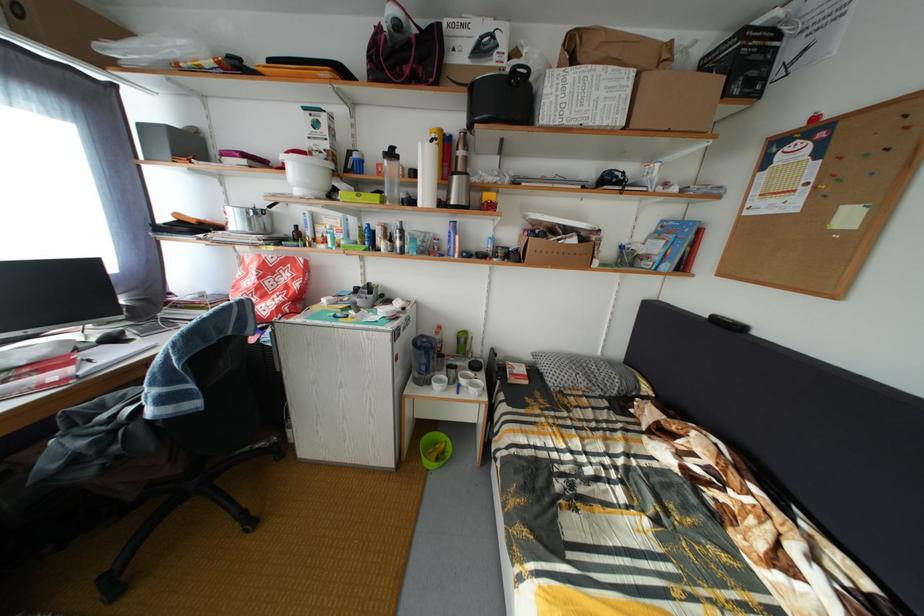
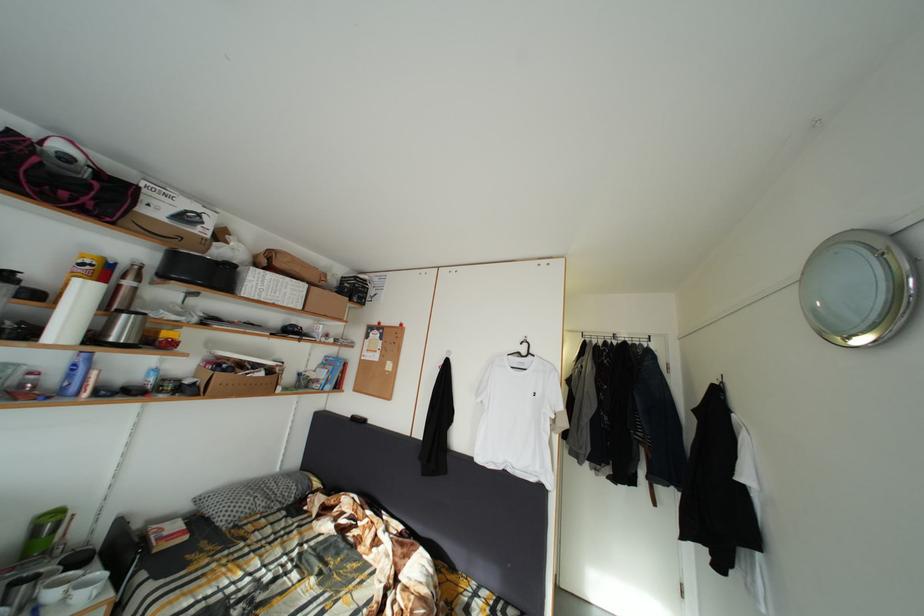
Find the pixel in the second image that matches point 460,209 in the first image.

(120, 345)